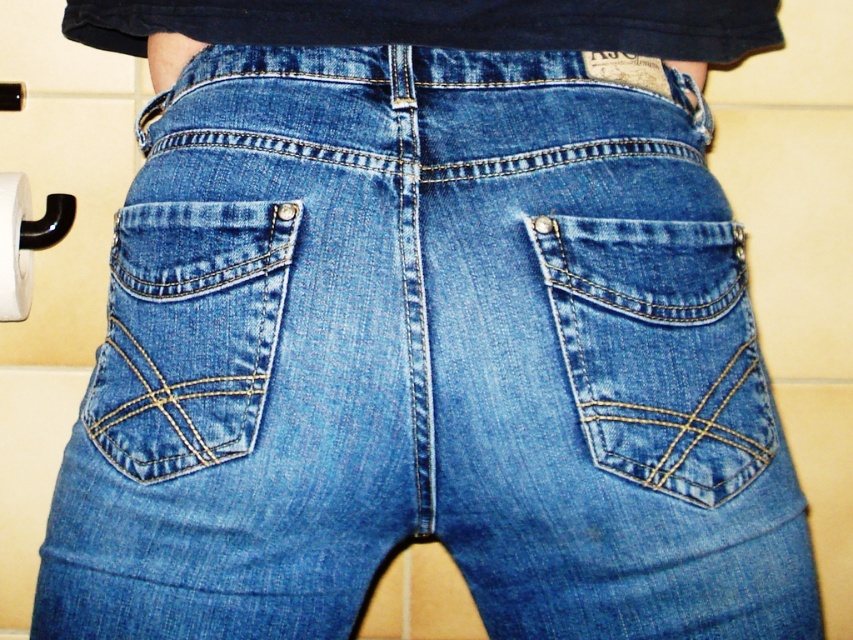
You are a tailor trying to attach a decorative button to the lower left side of the denim blue jeans pocket at lower left and the white matte toilet paper at lower left. Which object requires a longer button thread to accommodate its height?

The denim blue jeans pocket at lower left is taller than the white matte toilet paper at lower left, so the decorative button for the denim blue jeans pocket at lower left requires a longer thread to accommodate its height.

You are a tailor working on a pair of denim blue jeans pocket at lower left. You need to place a decorative button exactly 0.1 units to the right of the pocket. What are the coordinates where you should place the button?

The denim blue jeans pocket at lower left is located at point (189, 333). Adding 0.1 to the x coordinate gives 0.622, so the button should be placed at coordinates (189, 397).